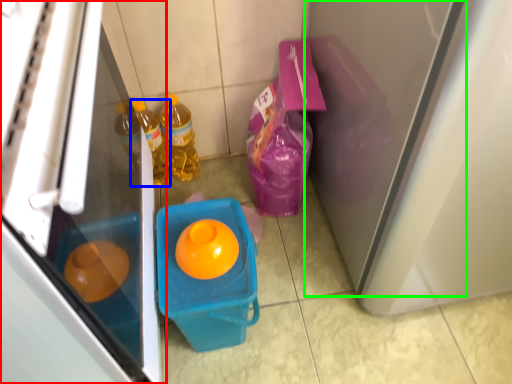
Question: Based on their relative distances, which object is farther from refrigerator (highlighted by a red box)? Choose from bottle (highlighted by a blue box) and screen door (highlighted by a green box).

Choices:
 (A) bottle
 (B) screen door

Answer: (A)